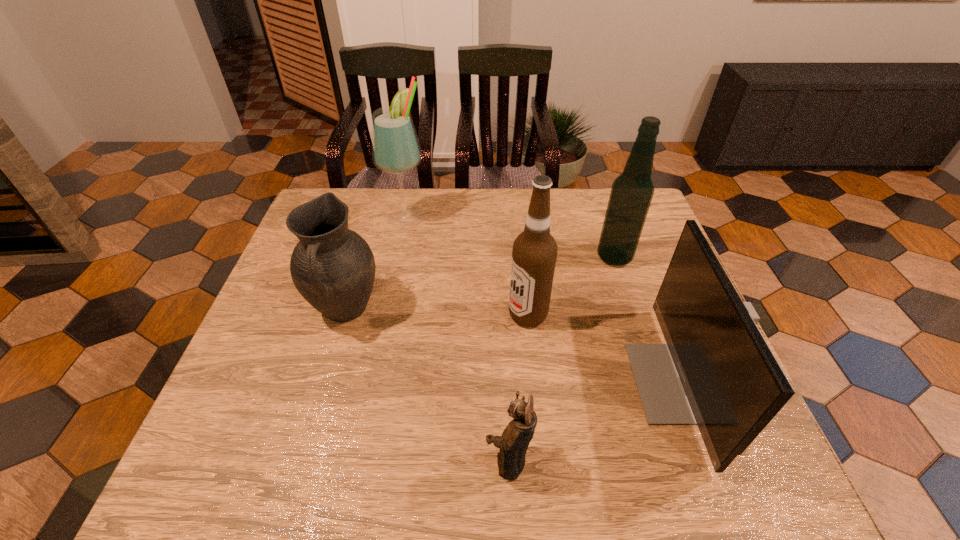
Image resolution: width=960 pixels, height=540 pixels. I want to click on object that is positioned at the far edge, so click(396, 150).

Where is `computer monitor present at the near edge`? The width and height of the screenshot is (960, 540). computer monitor present at the near edge is located at coordinates (717, 371).

At what (x,y) coordinates should I click in order to perform the action: click on figurine that is at the near edge. Please return your answer as a coordinate pair (x, y). Looking at the image, I should click on (515, 439).

Image resolution: width=960 pixels, height=540 pixels. What are the coordinates of `object positioned at the left edge` in the screenshot? It's located at (333, 268).

This screenshot has width=960, height=540. Find the location of `alcohol that is at the right edge`. alcohol that is at the right edge is located at coordinates (631, 194).

This screenshot has width=960, height=540. I want to click on computer monitor present at the right edge, so click(x=717, y=371).

Locate an element on the screen. This screenshot has width=960, height=540. object positioned at the near right corner is located at coordinates (717, 371).

Locate an element on the screen. free space at the far edge is located at coordinates (581, 194).

In the image, there is a desktop. What are the coordinates of `vacant space at the near edge` in the screenshot? It's located at (354, 478).

Locate an element on the screen. This screenshot has width=960, height=540. free space at the left edge of the desktop is located at coordinates (231, 435).